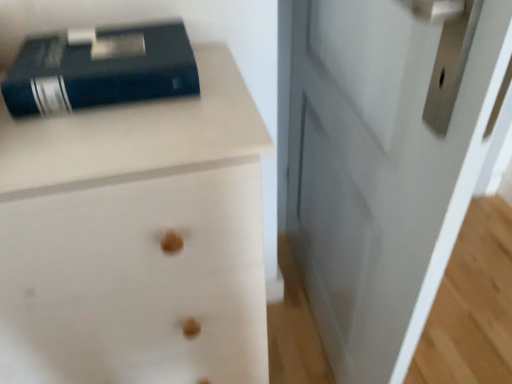
Question: Looking at the image, does white glossy door at center seem bigger or smaller compared to matte black book at upper left?

Choices:
 (A) big
 (B) small

Answer: (A)

Question: Which is correct: white glossy door at center is inside matte black book at upper left, or outside of it?

Choices:
 (A) outside
 (B) inside

Answer: (A)

Question: Which object is the farthest from the matte black book at upper left?

Choices:
 (A) white wood chest of drawers at upper left
 (B) white glossy door at center

Answer: (B)

Question: Based on their relative distances, which object is farther from the white wood chest of drawers at upper left?

Choices:
 (A) matte black book at upper left
 (B) white glossy door at center

Answer: (B)